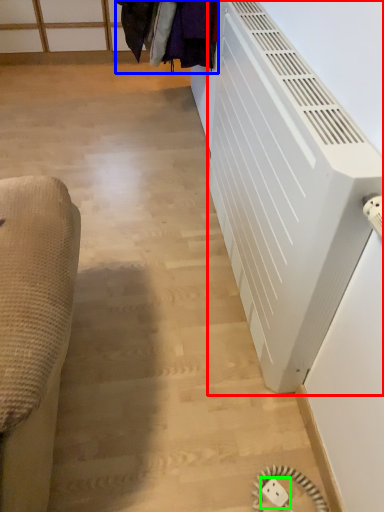
Question: Which object is positioned farthest from air conditioning (highlighted by a red box)? Select from laundry (highlighted by a blue box) and electric outlet (highlighted by a green box).

Choices:
 (A) laundry
 (B) electric outlet

Answer: (B)